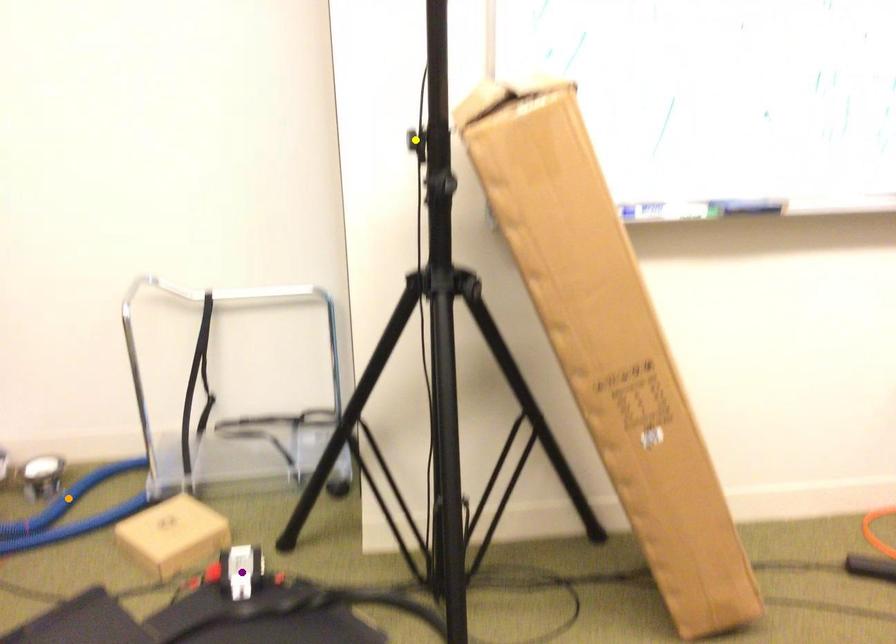
Order these from nearest to farthest:
purple point
orange point
yellow point

orange point < purple point < yellow point